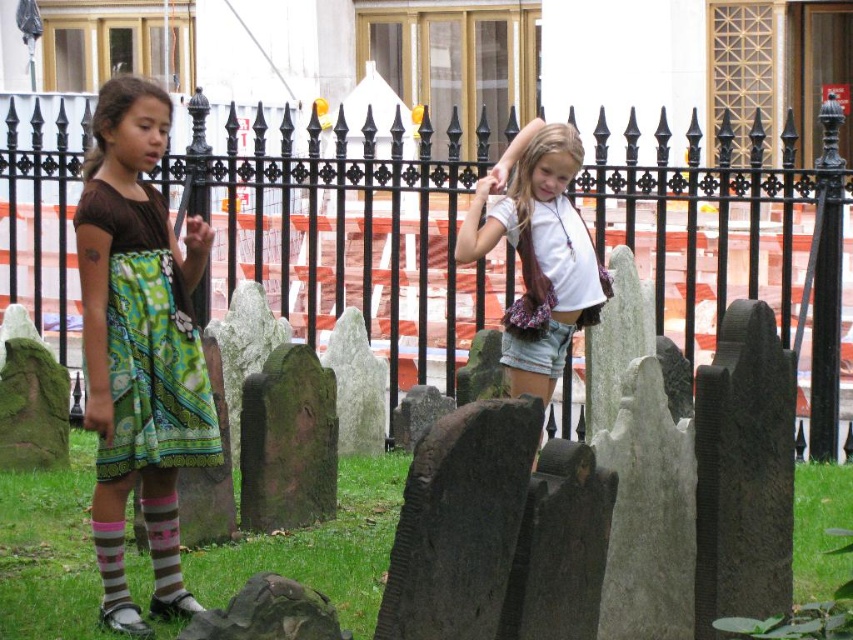
Question: Based on their relative distances, which object is nearer to the striped cotton sock at lower left?

Choices:
 (A) white cotton shirt at center
 (B) striped cotton socks at lower left

Answer: (B)

Question: Is black wrought iron fence at upper center thinner than striped cotton socks at lower left?

Choices:
 (A) yes
 (B) no

Answer: (B)

Question: Can you confirm if green printed fabric dress at left is thinner than white cotton shirt at center?

Choices:
 (A) no
 (B) yes

Answer: (B)

Question: Is white cotton shirt at center wider than striped cotton sock at lower left?

Choices:
 (A) no
 (B) yes

Answer: (B)

Question: Which point is farther from the camera taking this photo?

Choices:
 (A) (172, 348)
 (B) (560, 220)

Answer: (B)

Question: Which point is farther from the camera taking this photo?

Choices:
 (A) (178, 573)
 (B) (473, 324)

Answer: (B)